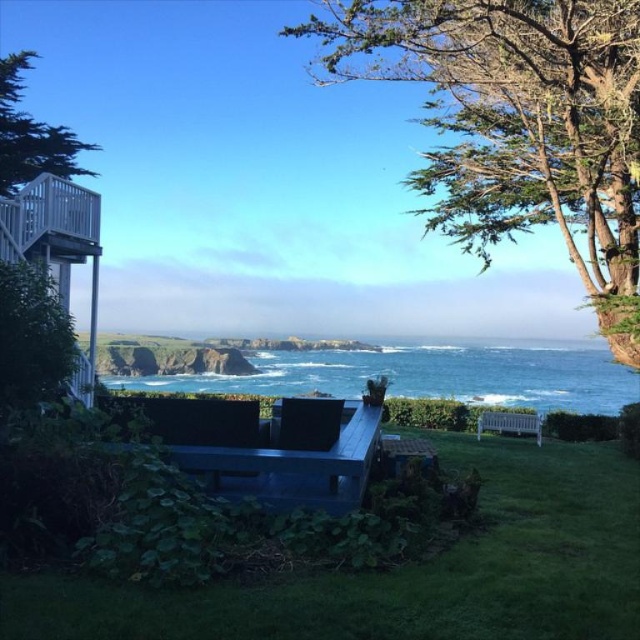
You are a visitor standing at the base of the staircase and want to sit on the bench closest to the ocean. Which bench should you choose between the blue wood bench at center and the white wooden bench at right?

The blue wood bench at center is positioned on the left side of white wooden bench at right. Since the white wooden bench at right is further to the right, it is closer to the ocean. Therefore, you should choose the white wooden bench at right.

You are a landscape architect designing a walking path between the green textured tree at upper right and the blue plastic bench at center. The path must be exactly 20 feet long. Will the path be long enough to reach the bench from the tree?

The green textured tree at upper right is 18.69 feet from the blue plastic bench at center. Since the required path length is 20 feet, which is longer than the actual distance between them, the path will be longer than needed and will comfortably reach the bench from the tree.